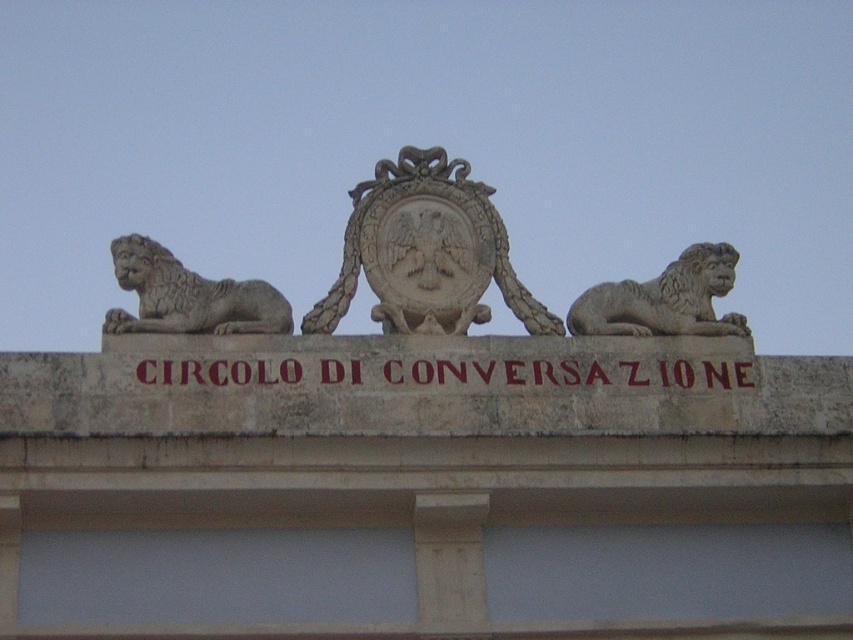
Is stone coat of arms at center thinner than brown stone sign at center?

Indeed, stone coat of arms at center has a lesser width compared to brown stone sign at center.

Does stone coat of arms at center have a greater width compared to brown stone sign at center?

No.

Where is `stone coat of arms at center`? The width and height of the screenshot is (853, 640). stone coat of arms at center is located at coordinates (426, 252).

Is stone coat of arms at center closer to camera compared to gray stone lion at upper right?

Yes, stone coat of arms at center is closer to the viewer.

Who is shorter, stone coat of arms at center or gray stone lion at upper right?

gray stone lion at upper right

Between point (506, 257) and point (726, 316), which one is positioned behind?

Positioned behind is point (726, 316).

Locate an element on the screen. The width and height of the screenshot is (853, 640). stone coat of arms at center is located at coordinates (426, 252).

Does brown stone sign at center have a lesser width compared to gray stone lion at upper right?

No.

Does point (186, 371) come in front of point (598, 284)?

Yes, it is in front of point (598, 284).

Find the location of a particular element. The image size is (853, 640). brown stone sign at center is located at coordinates (448, 372).